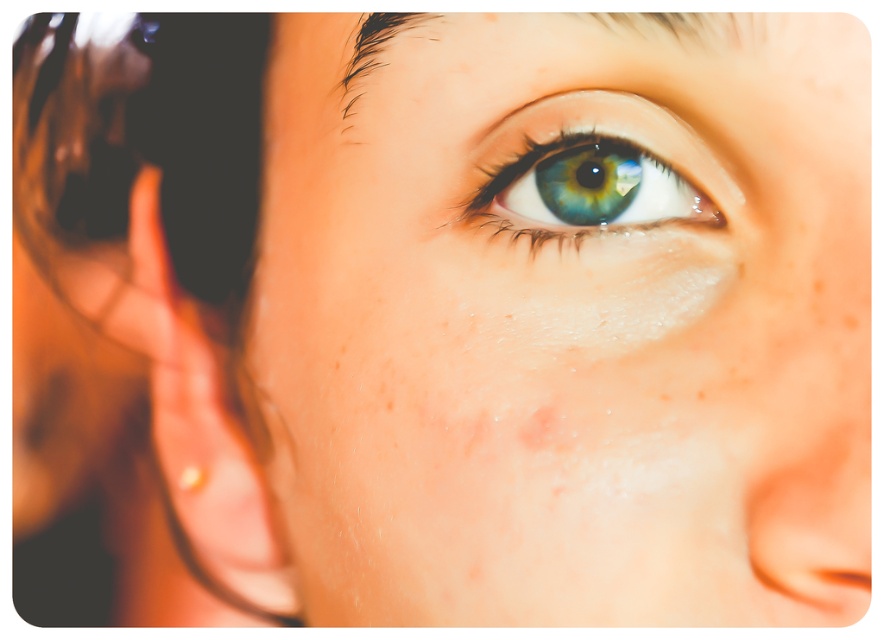
You are an artist analyzing the portrait. You notice two points in the image at coordinates point (465, 129) and point (179, 472). Which point is positioned closer to the viewer?

Point (465, 129) is closer to the viewer than point (179, 472).

You are a photographer analyzing this portrait. You notice a point at coordinates (568, 320). Based on the scene description, what does this point likely represent?

The point at coordinates (568, 320) indicates the smooth skin eye at center, as described in the scene.

You are an artist sketching this portrait and want to ensure the freckles and earring are placed correctly. Based on the image, is the pale skin freckle at center positioned to the right or left of the gold metallic earring at lower left?

The pale skin freckle at center is to the right of the gold metallic earring at lower left.